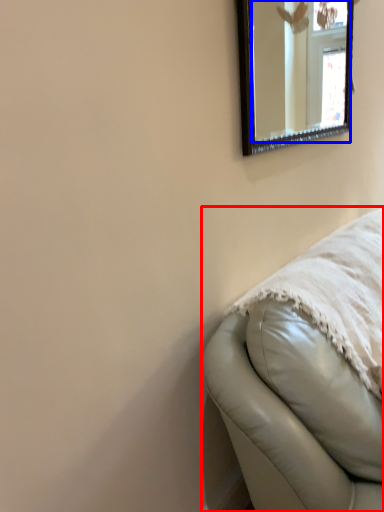
Question: Which of the following is the farthest to the observer, furniture (highlighted by a red box) or mirror (highlighted by a blue box)?

Choices:
 (A) furniture
 (B) mirror

Answer: (B)